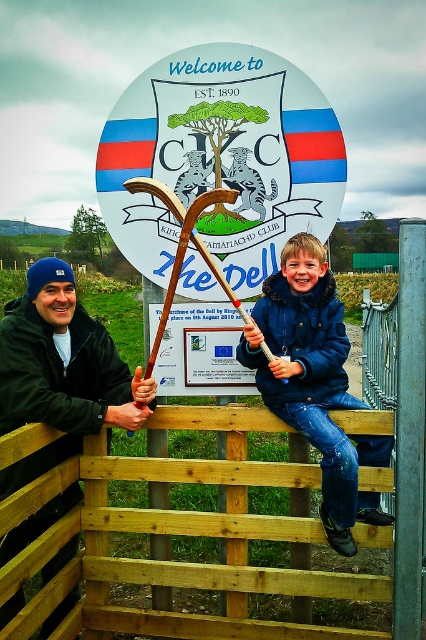
Who is higher up, white plastic sign at center or dark blue knit cap at left?

white plastic sign at center is above.

What do you see at coordinates (221, 157) in the screenshot?
I see `white plastic sign at center` at bounding box center [221, 157].

Identify the location of white plastic sign at center. Image resolution: width=426 pixels, height=640 pixels. (221, 157).

Looking at this image, does yellow wooden fence at center come in front of dark blue knit cap at left?

Yes, it is.

Is yellow wooden fence at center further to the viewer compared to dark blue knit cap at left?

No, yellow wooden fence at center is closer to the viewer.

Find the location of a particular element. The width and height of the screenshot is (426, 640). yellow wooden fence at center is located at coordinates (227, 515).

Does yellow wooden fence at center have a greater height compared to white plastic sign at center?

Correct, yellow wooden fence at center is much taller as white plastic sign at center.

Is point (52, 608) positioned behind point (314, 164)?

No.

Identify the location of yellow wooden fence at center. This screenshot has height=640, width=426. (227, 515).